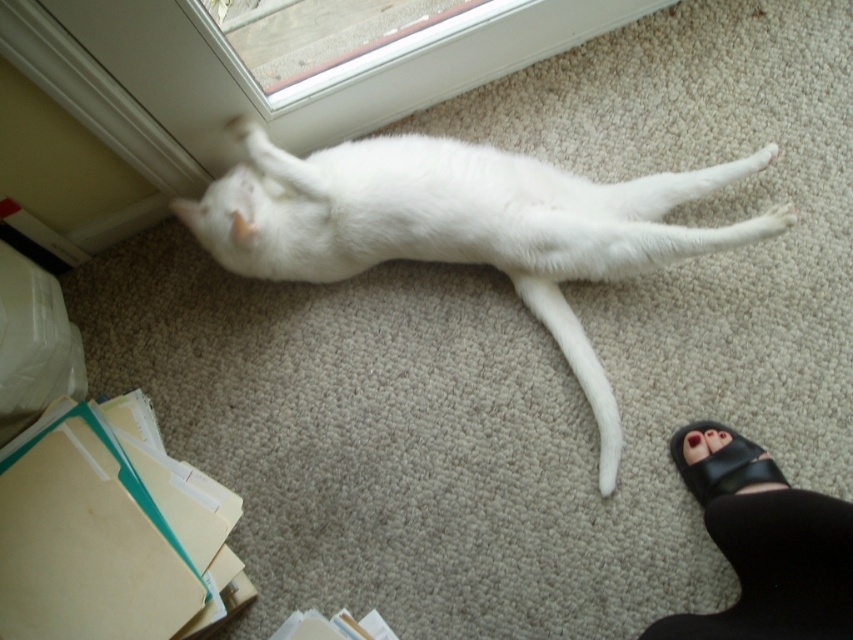
You are a delivery person who just arrived at the doorstep. You see a white fur cat at center and black leather sandals at lower right. Can you safely place a small package between them without disturbing the cat?

The white fur cat at center and black leather sandals at lower right are 12.92 inches apart. Since 12.92 inches is more than enough space to place a small package between them without disturbing the cat, you can safely do so.

You are a delivery person who needs to place a small package on the floor near the white fur cat at center and the black leather sandals at lower right. Which object should you avoid placing the package too close to, considering their sizes?

You should avoid placing the package too close to the white fur cat at center because it is bigger than the black leather sandals at lower right and might knock the package over.

You are a delivery person who needs to step over the black leather sandals at lower right and the black leather sandal at lower right to pick up a package. Can you safely step over the space between them?

The black leather sandals at lower right and black leather sandal at lower right are 3.80 inches apart. Since the gap is narrow, stepping over might be difficult and could lead to tripping. It is advisable to move the sandals aside first for safety.